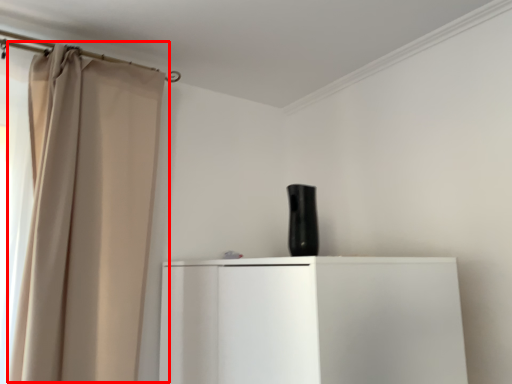
Question: From the image, what is the correct spatial relationship of curtain (annotated by the red box) in relation to appliance?

Choices:
 (A) left
 (B) right

Answer: (A)